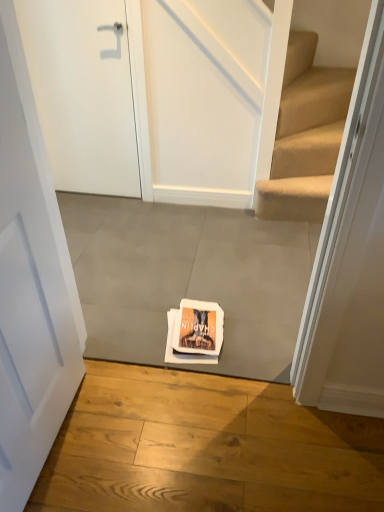
Question: Is gray concrete at center, marked as the 1th concrete in a front-to-back arrangement, in front of or behind white matte door at center, which appears as the first door when ordered from the bottom, in the image?

Choices:
 (A) behind
 (B) front

Answer: (A)

Question: From their relative heights in the image, would you say gray concrete at center, acting as the first concrete starting from the bottom, is taller or shorter than white matte door at center, acting as the 2th door starting from the back?

Choices:
 (A) short
 (B) tall

Answer: (A)

Question: Which of these objects is positioned closest to the white matte door at upper left, which ranks as the 2th door in bottom-to-top order?

Choices:
 (A) gray concrete at center, the second concrete when ordered from back to front
 (B) gray concrete at center, acting as the 1th concrete starting from the back
 (C) white matte door at center, the second door viewed from the top

Answer: (B)

Question: Which object is positioned farthest from the white matte door at center, acting as the 2th door starting from the back?

Choices:
 (A) gray concrete at center, the second concrete from the top
 (B) white matte door at upper left, positioned as the 1th door in top-to-bottom order
 (C) gray concrete at center, acting as the 1th concrete starting from the back

Answer: (B)